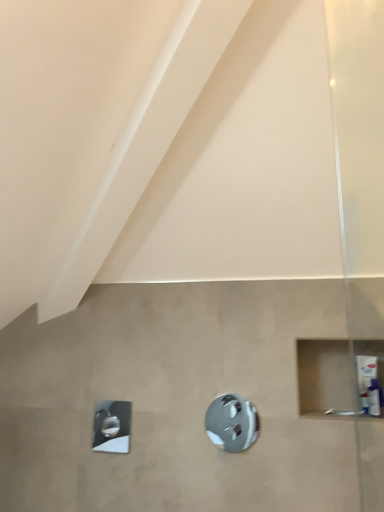
What do you see at coordinates (374, 398) in the screenshot?
I see `white plastic tube at right` at bounding box center [374, 398].

Find the location of a particular element. white plastic tube at right is located at coordinates (374, 398).

Which object is wider, white plastic tube at right or polished chrome showerhead at lower left, the first shower from the back?

white plastic tube at right.

From a real-world perspective, is white plastic tube at right beneath polished chrome showerhead at lower left, the first shower from the back?

No, from a real-world perspective, white plastic tube at right is not beneath polished chrome showerhead at lower left, the first shower from the back.

Based on the photo, is white plastic tube at right positioned with its back to polished chrome showerhead at lower left, the first shower positioned from the left?

No, white plastic tube at right is not facing the opposite direction of polished chrome showerhead at lower left, the first shower positioned from the left.

Is point (378, 400) closer or farther from the camera than point (110, 418)?

Clearly, point (378, 400) is closer to the camera than point (110, 418).

In terms of height, does polished chrome shower at center, the 2th shower viewed from the back, look taller or shorter compared to polished chrome showerhead at lower left, the first shower from the back?

polished chrome shower at center, the 2th shower viewed from the back, is taller than polished chrome showerhead at lower left, the first shower from the back.

Which is closer to the camera, (246, 436) or (130, 411)?

The point (246, 436) is closer.

Is polished chrome showerhead at lower left, the first shower positioned from the left, at the back of polished chrome shower at center, the 2th shower viewed from the back?

No.

Measure the distance from polished chrome shower at center, placed as the 1th shower when sorted from front to back, to white plastic tube at right.

A distance of 19.50 inches exists between polished chrome shower at center, placed as the 1th shower when sorted from front to back, and white plastic tube at right.

Is polished chrome shower at center, the 2th shower viewed from the back, looking in the opposite direction of white plastic tube at right?

No, white plastic tube at right is not at the back of polished chrome shower at center, the 2th shower viewed from the back.

Which is more to the right, polished chrome shower at center, the 2th shower viewed from the back, or white plastic tube at right?

white plastic tube at right.

Which of these two, polished chrome shower at center, which is counted as the second shower, starting from the left, or white plastic tube at right, is thinner?

Thinner between the two is polished chrome shower at center, which is counted as the second shower, starting from the left.

Is polished chrome showerhead at lower left, which appears as the second shower when viewed from the right, positioned behind polished chrome shower at center, placed as the 1th shower when sorted from front to back?

Yes, the depth of polished chrome showerhead at lower left, which appears as the second shower when viewed from the right, is greater than that of polished chrome shower at center, placed as the 1th shower when sorted from front to back.

Who is shorter, polished chrome showerhead at lower left, the first shower from the back, or polished chrome shower at center, which is counted as the second shower, starting from the left?

polished chrome showerhead at lower left, the first shower from the back.

Considering the sizes of polished chrome showerhead at lower left, the 2th shower from the front, and polished chrome shower at center, which is counted as the second shower, starting from the left, in the image, is polished chrome showerhead at lower left, the 2th shower from the front, wider or thinner than polished chrome shower at center, which is counted as the second shower, starting from the left,?

polished chrome showerhead at lower left, the 2th shower from the front, is wider than polished chrome shower at center, which is counted as the second shower, starting from the left.

Is polished chrome showerhead at lower left, the first shower from the back, positioned with its back to polished chrome shower at center, placed as the 1th shower when sorted from front to back?

polished chrome showerhead at lower left, the first shower from the back, is not turned away from polished chrome shower at center, placed as the 1th shower when sorted from front to back.

Can you confirm if white plastic tube at right is positioned to the left of polished chrome shower at center, which is counted as the second shower, starting from the left?

No, white plastic tube at right is not to the left of polished chrome shower at center, which is counted as the second shower, starting from the left.

From the image's perspective, which one is positioned higher, white plastic tube at right or polished chrome shower at center, the 1th shower viewed from the right?

white plastic tube at right is shown above in the image.

Is the depth of white plastic tube at right less than that of polished chrome shower at center, the 1th shower viewed from the right?

That is True.

Based on the photo, is polished chrome showerhead at lower left, the first shower from the back, facing away from white plastic tube at right?

That's not correct — polished chrome showerhead at lower left, the first shower from the back, is not looking away from white plastic tube at right.

In terms of width, does polished chrome showerhead at lower left, the first shower positioned from the left, look wider or thinner when compared to white plastic tube at right?

polished chrome showerhead at lower left, the first shower positioned from the left, is thinner than white plastic tube at right.

From a real-world perspective, is polished chrome showerhead at lower left, the first shower from the back, physically above white plastic tube at right?

Actually, polished chrome showerhead at lower left, the first shower from the back, is physically below white plastic tube at right in the real world.

The image size is (384, 512). I want to click on toiletry that appears above the polished chrome showerhead at lower left, which appears as the second shower when viewed from the right (from the image's perspective), so click(x=374, y=398).

Where is `shower that appears below the polished chrome shower at center, the 2th shower viewed from the back (from the image's perspective)`? shower that appears below the polished chrome shower at center, the 2th shower viewed from the back (from the image's perspective) is located at coordinates (112, 426).

Which object lies nearer to the anchor point polished chrome showerhead at lower left, the 2th shower from the front, white plastic tube at right or polished chrome shower at center, the 2th shower viewed from the back?

The object closer to polished chrome showerhead at lower left, the 2th shower from the front, is polished chrome shower at center, the 2th shower viewed from the back.

Which object lies further to the anchor point polished chrome showerhead at lower left, which appears as the second shower when viewed from the right, polished chrome shower at center, the 2th shower viewed from the back, or white plastic tube at right?

Based on the image, white plastic tube at right appears to be further to polished chrome showerhead at lower left, which appears as the second shower when viewed from the right.

When comparing their distances from white plastic tube at right, does polished chrome shower at center, which is counted as the second shower, starting from the left, or polished chrome showerhead at lower left, the 2th shower from the front, seem closer?

The object closer to white plastic tube at right is polished chrome shower at center, which is counted as the second shower, starting from the left.

Considering their positions, is polished chrome showerhead at lower left, the first shower positioned from the left, positioned further to white plastic tube at right than polished chrome shower at center, the 1th shower viewed from the right?

polished chrome showerhead at lower left, the first shower positioned from the left, is positioned further to the anchor white plastic tube at right.

Considering their positions, is white plastic tube at right positioned closer to polished chrome shower at center, which is counted as the second shower, starting from the left, than polished chrome showerhead at lower left, the first shower from the back?

Based on the image, polished chrome showerhead at lower left, the first shower from the back, appears to be nearer to polished chrome shower at center, which is counted as the second shower, starting from the left.

Considering their positions, is polished chrome showerhead at lower left, which appears as the second shower when viewed from the right, positioned further to polished chrome shower at center, the 2th shower viewed from the back, than white plastic tube at right?

white plastic tube at right is positioned further to the anchor polished chrome shower at center, the 2th shower viewed from the back.

At what (x,y) coordinates should I click in order to perform the action: click on shower between polished chrome showerhead at lower left, which appears as the second shower when viewed from the right, and white plastic tube at right, in the horizontal direction. Please return your answer as a coordinate pair (x, y). This screenshot has height=512, width=384. Looking at the image, I should click on (232, 422).